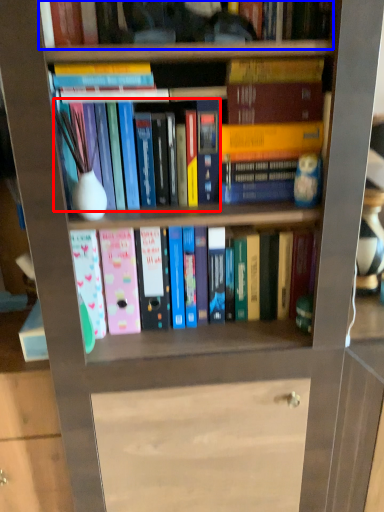
Question: Among these objects, which one is nearest to the camera, book (highlighted by a red box) or book (highlighted by a blue box)?

Choices:
 (A) book
 (B) book

Answer: (B)